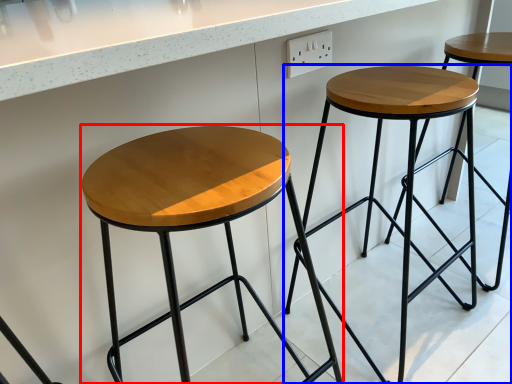
Question: Which point is further to the camera, stool (highlighted by a red box) or stool (highlighted by a blue box)?

Choices:
 (A) stool
 (B) stool

Answer: (B)